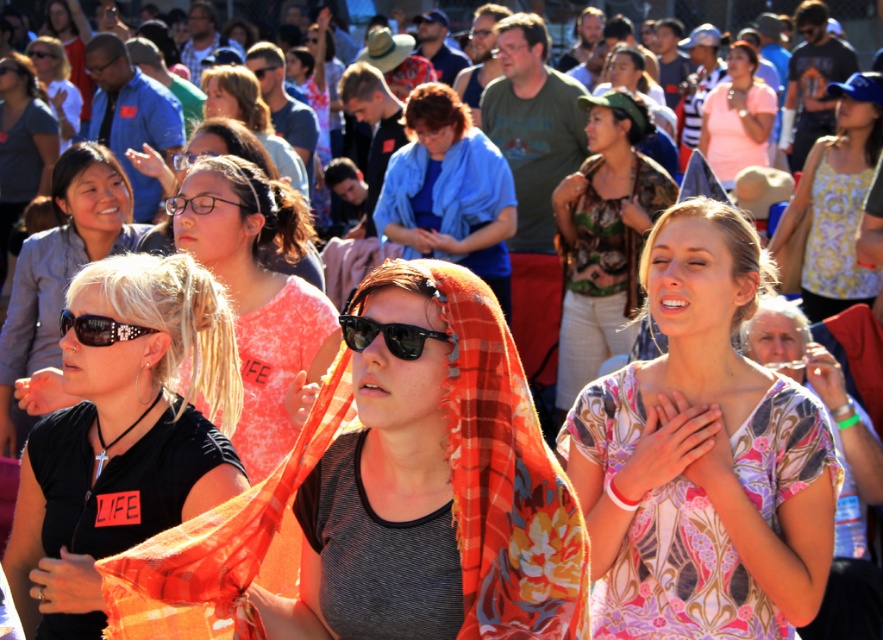
You are a photographer trying to capture a photo of the blue cotton shirt at center and the yellow printed tank top at upper right. Which one should you focus on first if you want to include both in your frame without moving the camera?

The blue cotton shirt at center is positioned on the left side of the yellow printed tank top at upper right, so you should focus on the blue cotton shirt at center first to ensure both are in the frame.